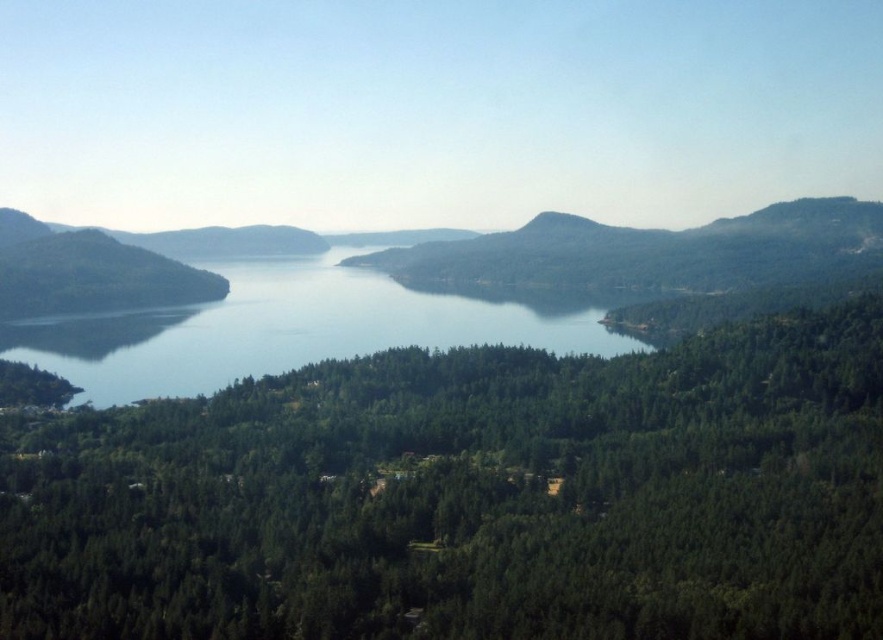
Question: Which point is farther to the camera?

Choices:
 (A) clear blue water at center
 (B) green matte forest at center

Answer: (A)

Question: Does green matte forest at center have a larger size compared to clear blue water at center?

Choices:
 (A) no
 (B) yes

Answer: (A)

Question: Is the position of green matte forest at center less distant than that of clear blue water at center?

Choices:
 (A) yes
 (B) no

Answer: (A)

Question: Does green matte forest at center lie in front of clear blue water at center?

Choices:
 (A) no
 (B) yes

Answer: (B)

Question: Which of the following is the farthest from the observer?

Choices:
 (A) (133, 317)
 (B) (730, 580)

Answer: (A)